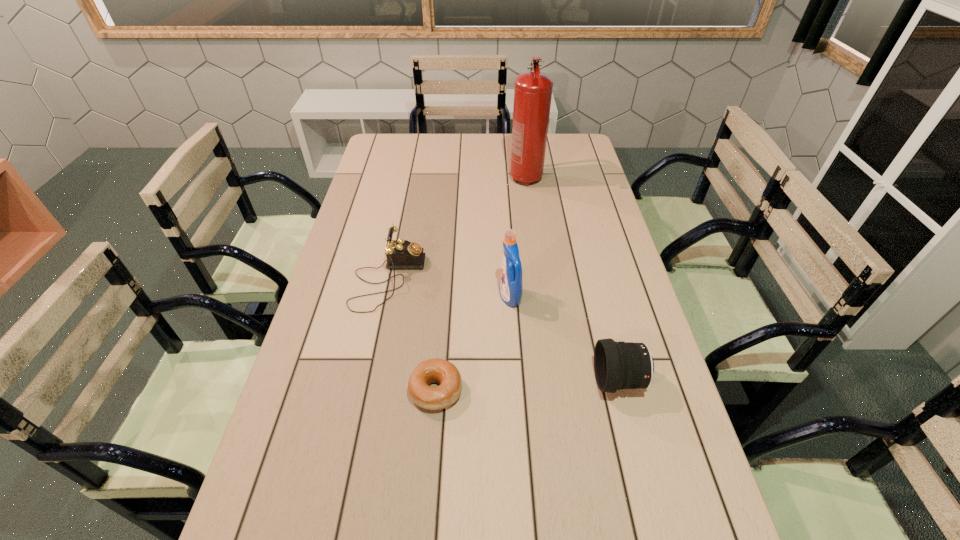
The height and width of the screenshot is (540, 960). I want to click on free spot between the telephoto lens and the farthest object, so click(x=572, y=279).

Identify the location of object that is the second closest to the detergent. This screenshot has height=540, width=960. (617, 365).

Select which object is the closest to the tallest object. Please provide its 2D coordinates. Your answer should be formatted as a tuple, i.e. [(x, y)], where the tuple contains the x and y coordinates of a point satisfying the conditions above.

[(401, 254)]

Image resolution: width=960 pixels, height=540 pixels. What are the coordinates of `free space that satisfies the following two spatial constraints: 1. on the handle side the farthest object; 2. on the label of the second tallest object` in the screenshot? It's located at (541, 297).

Locate an element on the screen. The width and height of the screenshot is (960, 540). free space in the image that satisfies the following two spatial constraints: 1. on the handle side the fire extinguisher; 2. on the label of the second tallest object is located at coordinates (541, 297).

The height and width of the screenshot is (540, 960). Identify the location of vacant area in the image that satisfies the following two spatial constraints: 1. on the handle side the tallest object; 2. on the dial of the leftmost object. (540, 279).

The image size is (960, 540). Find the location of `free space that satisfies the following two spatial constraints: 1. on the dial of the leftmost object; 2. on the right side of the shortest object`. free space that satisfies the following two spatial constraints: 1. on the dial of the leftmost object; 2. on the right side of the shortest object is located at coordinates (365, 390).